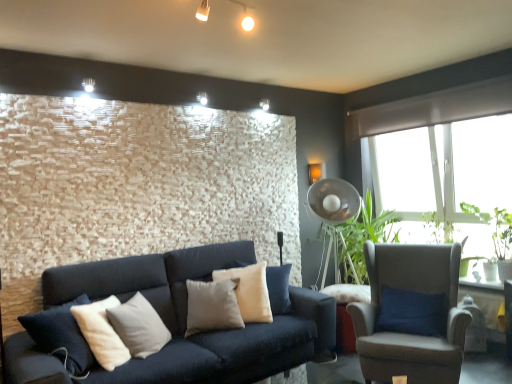
Question: In the image, is green leafy plant at right, positioned as the 2th plant in back-to-front order, on the left side or the right side of green leafy plant at right, marked as the second plant in a front-to-back arrangement?

Choices:
 (A) left
 (B) right

Answer: (B)

Question: From their relative heights in the image, would you say green leafy plant at right, positioned as the 2th plant in back-to-front order, is taller or shorter than green leafy plant at right, the 1th plant from the back?

Choices:
 (A) tall
 (B) short

Answer: (A)

Question: Based on their relative distances, which object is farther from the green leafy plant at right, the 1th plant from the back?

Choices:
 (A) beige fabric pillow at center
 (B) metallic silver fan at center-right
 (C) green leafy plant at right, positioned as the 2th plant in back-to-front order
 (D) light beige fabric armchair at right

Answer: (A)

Question: Which object is the closest to the green leafy plant at right, positioned as the 2th plant in back-to-front order?

Choices:
 (A) metallic silver fan at center-right
 (B) green leafy plant at right, the 1th plant from the back
 (C) light beige fabric armchair at right
 (D) beige fabric pillow at center

Answer: (B)